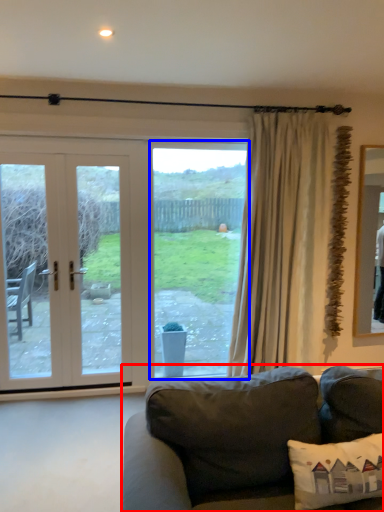
Question: Which object appears farthest to the camera in this image, studio couch (highlighted by a red box) or window (highlighted by a blue box)?

Choices:
 (A) studio couch
 (B) window

Answer: (B)